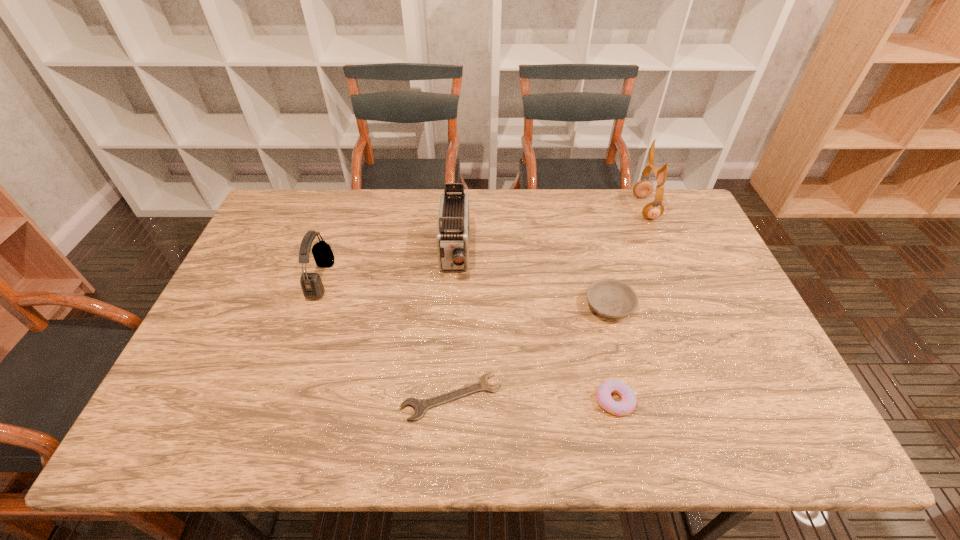
The image size is (960, 540). In order to click on the rightmost object in this screenshot , I will do `click(644, 188)`.

Locate an element on the screen. This screenshot has height=540, width=960. the farthest object is located at coordinates (644, 188).

Locate an element on the screen. The width and height of the screenshot is (960, 540). camcorder is located at coordinates pos(452,238).

At what (x,y) coordinates should I click in order to perform the action: click on the leftmost object. Please return your answer as a coordinate pair (x, y). Looking at the image, I should click on (311, 283).

You are a GUI agent. You are given a task and a screenshot of the screen. Output one action in this format:
    pyautogui.click(x=<x>, y=<y>)
    Task: Click on the third tallest object
    The width and height of the screenshot is (960, 540).
    Given the screenshot: What is the action you would take?
    pyautogui.click(x=311, y=283)

This screenshot has height=540, width=960. What are the coordinates of `the third shortest object` in the screenshot? It's located at (611, 298).

Where is `the second shortest object`? This screenshot has width=960, height=540. the second shortest object is located at coordinates (628, 402).

Identify the location of wrench. This screenshot has width=960, height=540. (420, 406).

Where is `free spot located 0.060m on the front-facing side of the farthest object`? The width and height of the screenshot is (960, 540). free spot located 0.060m on the front-facing side of the farthest object is located at coordinates (617, 208).

Identify the location of vacant space located 0.130m on the front-facing side of the farthest object. The image size is (960, 540). (597, 208).